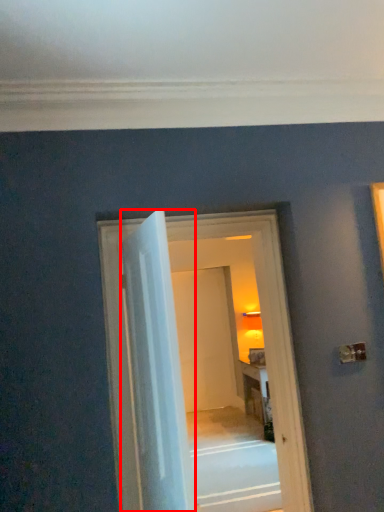
Question: Observing the image, what is the correct spatial positioning of door (annotated by the red box) in reference to door?

Choices:
 (A) left
 (B) right

Answer: (A)